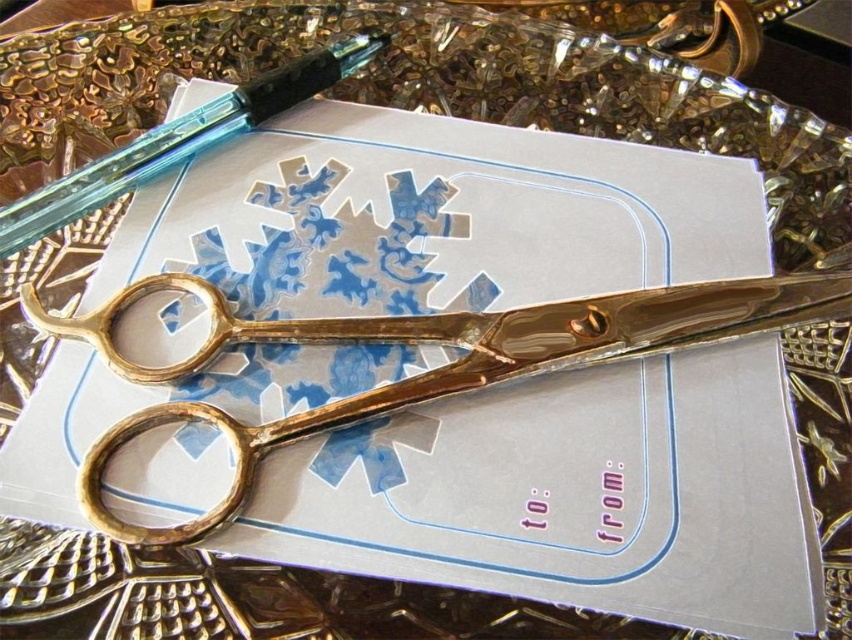
Based on the photo, is gold polished scissors at center thinner than translucent blue glass pen at upper left?

No, gold polished scissors at center is not thinner than translucent blue glass pen at upper left.

Measure the distance between gold polished scissors at center and camera.

gold polished scissors at center and camera are 10.85 inches apart.

Identify the location of gold polished scissors at center. The height and width of the screenshot is (640, 852). (436, 368).